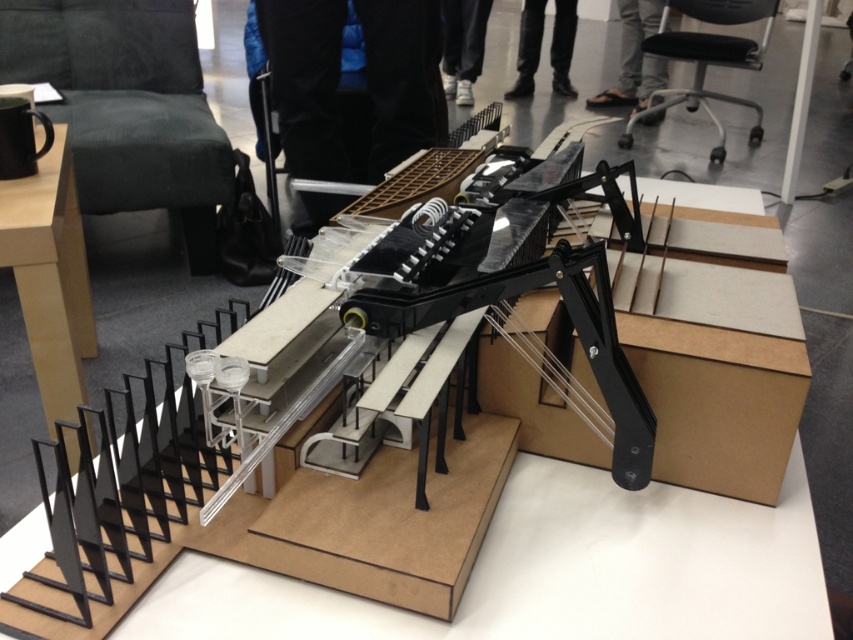
Question: Which point is closer to the camera?

Choices:
 (A) black fabric pants at center
 (B) black leather pants at upper center

Answer: (A)

Question: Among these objects, which one is nearest to the camera?

Choices:
 (A) black fabric pants at center
 (B) black leather pants at upper center
 (C) gray fabric pants at upper center
 (D) white fabric pants at center

Answer: (A)

Question: Is black fabric pants at center closer to the viewer compared to gray fabric pants at upper center?

Choices:
 (A) yes
 (B) no

Answer: (A)

Question: Is gray fabric pants at upper center smaller than white fabric pants at center?

Choices:
 (A) yes
 (B) no

Answer: (B)

Question: Based on their relative distances, which object is farther from the white fabric pants at center?

Choices:
 (A) black fabric pants at center
 (B) gray fabric pants at upper center

Answer: (A)

Question: Does gray fabric pants at upper center have a larger size compared to white fabric pants at center?

Choices:
 (A) no
 (B) yes

Answer: (B)